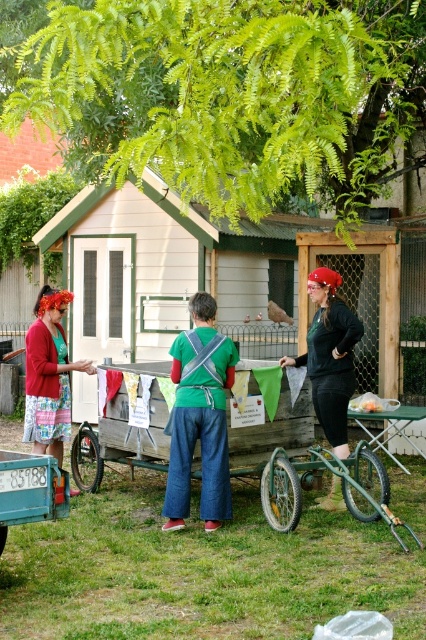
Question: From the image, what is the correct spatial relationship of green denim pants at center in relation to floral-patterned fabric dress at left?

Choices:
 (A) below
 (B) above

Answer: (A)

Question: Based on their relative distances, which object is nearer to the green denim pants at center?

Choices:
 (A) floral-patterned fabric dress at left
 (B) matte black shirt at center

Answer: (B)

Question: Is the position of matte black shirt at center more distant than that of floral-patterned fabric dress at left?

Choices:
 (A) yes
 (B) no

Answer: (B)

Question: Which object is the farthest from the matte black shirt at center?

Choices:
 (A) green denim pants at center
 (B) floral-patterned fabric dress at left

Answer: (B)

Question: Based on their relative distances, which object is nearer to the matte black shirt at center?

Choices:
 (A) green denim pants at center
 (B) floral-patterned fabric dress at left

Answer: (A)

Question: Does green denim pants at center have a larger size compared to floral-patterned fabric dress at left?

Choices:
 (A) yes
 (B) no

Answer: (B)